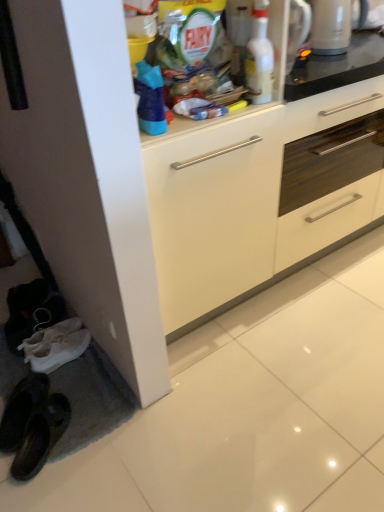
Question: Considering the relative sizes of white glossy bottle at upper center and white glossy kettle at upper right in the image provided, is white glossy bottle at upper center thinner than white glossy kettle at upper right?

Choices:
 (A) yes
 (B) no

Answer: (A)

Question: Is white glossy bottle at upper center wider than white glossy kettle at upper right?

Choices:
 (A) yes
 (B) no

Answer: (B)

Question: Is white glossy bottle at upper center bigger than white glossy kettle at upper right?

Choices:
 (A) yes
 (B) no

Answer: (B)

Question: Is white glossy bottle at upper center aimed at white glossy kettle at upper right?

Choices:
 (A) no
 (B) yes

Answer: (A)

Question: Considering the relative sizes of white glossy bottle at upper center and white glossy kettle at upper right in the image provided, is white glossy bottle at upper center taller than white glossy kettle at upper right?

Choices:
 (A) no
 (B) yes

Answer: (B)

Question: In the image, is white glossy bottle at upper center positioned in front of or behind white glossy cabinet at center?

Choices:
 (A) front
 (B) behind

Answer: (A)

Question: From a real-world perspective, is white glossy bottle at upper center above or below white glossy cabinet at center?

Choices:
 (A) below
 (B) above

Answer: (B)

Question: From the image's perspective, is white glossy bottle at upper center located above or below white glossy cabinet at center?

Choices:
 (A) below
 (B) above

Answer: (B)

Question: Is point (264, 49) closer or farther from the camera than point (380, 138)?

Choices:
 (A) farther
 (B) closer

Answer: (B)

Question: Considering the positions of white glossy kettle at upper right and white glossy bottle at upper center in the image, is white glossy kettle at upper right wider or thinner than white glossy bottle at upper center?

Choices:
 (A) thin
 (B) wide

Answer: (B)

Question: Based on their sizes in the image, would you say white glossy kettle at upper right is bigger or smaller than white glossy bottle at upper center?

Choices:
 (A) big
 (B) small

Answer: (A)

Question: From a real-world perspective, relative to white glossy bottle at upper center, is white glossy kettle at upper right vertically above or below?

Choices:
 (A) above
 (B) below

Answer: (B)

Question: In the image, is white glossy kettle at upper right on the left side or the right side of white glossy bottle at upper center?

Choices:
 (A) right
 (B) left

Answer: (A)

Question: Considering the positions of white glossy cabinet at center and white glossy kettle at upper right in the image, is white glossy cabinet at center wider or thinner than white glossy kettle at upper right?

Choices:
 (A) wide
 (B) thin

Answer: (A)

Question: Is point (345, 207) closer or farther from the camera than point (337, 31)?

Choices:
 (A) farther
 (B) closer

Answer: (A)